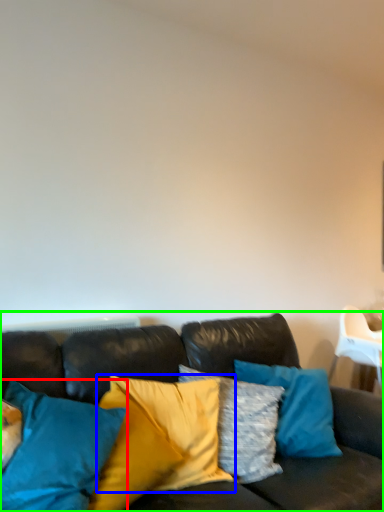
Question: Based on their relative distances, which object is farther from pillow (highlighted by a red box)? Choose from pillow (highlighted by a blue box) and studio couch (highlighted by a green box).

Choices:
 (A) pillow
 (B) studio couch

Answer: (A)